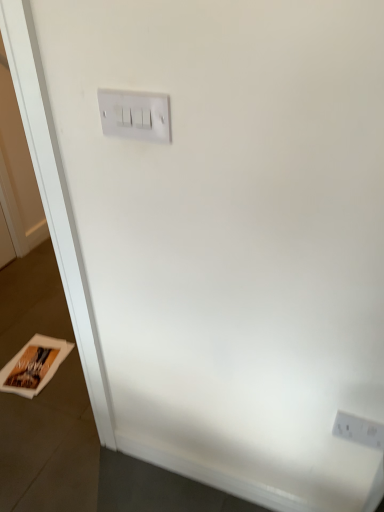
Describe the element at coordinates (359, 430) in the screenshot. Image resolution: width=384 pixels, height=512 pixels. I see `white plastic power plugs and sockets at lower right` at that location.

Identify the location of white plastic power plugs and sockets at lower right. This screenshot has width=384, height=512. (359, 430).

The image size is (384, 512). I want to click on white glossy magazine at lower left, so click(x=34, y=366).

What do you see at coordinates (34, 366) in the screenshot? This screenshot has height=512, width=384. I see `white glossy magazine at lower left` at bounding box center [34, 366].

Measure the distance between point [40,390] and camera.

The distance of point [40,390] from camera is 1.67 meters.

This screenshot has width=384, height=512. What are the coordinates of `white plastic power plugs and sockets at lower right` in the screenshot? It's located at (359, 430).

Which is more to the right, white plastic power plugs and sockets at lower right or white glossy magazine at lower left?

Positioned to the right is white plastic power plugs and sockets at lower right.

Is white plastic power plugs and sockets at lower right behind white glossy magazine at lower left?

No, it is not.

Considering the points (357, 426) and (6, 374), which point is in front, point (357, 426) or point (6, 374)?

The point (357, 426) is closer.

From the image's perspective, between white plastic power plugs and sockets at lower right and white glossy magazine at lower left, which one is located above?

From the image's view, white plastic power plugs and sockets at lower right is above.

From a real-world perspective, who is located higher, white plastic power plugs and sockets at lower right or white glossy magazine at lower left?

In real-world perspective, white plastic power plugs and sockets at lower right is above.

Can you confirm if white plastic power plugs and sockets at lower right is thinner than white glossy magazine at lower left?

Yes.

Considering the sizes of white plastic power plugs and sockets at lower right and white glossy magazine at lower left in the image, is white plastic power plugs and sockets at lower right taller or shorter than white glossy magazine at lower left?

Clearly, white plastic power plugs and sockets at lower right is taller compared to white glossy magazine at lower left.

Is white plastic power plugs and sockets at lower right bigger than white glossy magazine at lower left?

Actually, white plastic power plugs and sockets at lower right might be smaller than white glossy magazine at lower left.

Would you say white glossy magazine at lower left is part of white plastic power plugs and sockets at lower right's contents?

Actually, white glossy magazine at lower left is outside white plastic power plugs and sockets at lower right.

Is white plastic power plugs and sockets at lower right directly adjacent to white glossy magazine at lower left?

No, white plastic power plugs and sockets at lower right is not next to white glossy magazine at lower left.

Is white plastic power plugs and sockets at lower right positioned with its back to white glossy magazine at lower left?

white plastic power plugs and sockets at lower right is not turned away from white glossy magazine at lower left.

How distant is white plastic power plugs and sockets at lower right from white glossy magazine at lower left?

white plastic power plugs and sockets at lower right is 4.04 feet away from white glossy magazine at lower left.

What are the coordinates of `magazine that is below the white plastic power plugs and sockets at lower right (from the image's perspective)` in the screenshot? It's located at (34, 366).

Considering the relative positions of white glossy magazine at lower left and white plastic power plugs and sockets at lower right in the image provided, is white glossy magazine at lower left to the right of white plastic power plugs and sockets at lower right from the viewer's perspective?

No.

From the picture: Between white glossy magazine at lower left and white plastic power plugs and sockets at lower right, which one is positioned behind?

white glossy magazine at lower left is more distant.

Which is behind, point (52, 375) or point (337, 428)?

The point (52, 375) is farther from the camera.

From the image's perspective, between white glossy magazine at lower left and white plastic power plugs and sockets at lower right, which one is located above?

white plastic power plugs and sockets at lower right is shown above in the image.

From a real-world perspective, which object rests below the other?

white glossy magazine at lower left is physically lower.

Considering the relative sizes of white glossy magazine at lower left and white plastic power plugs and sockets at lower right in the image provided, is white glossy magazine at lower left thinner than white plastic power plugs and sockets at lower right?

No, white glossy magazine at lower left is not thinner than white plastic power plugs and sockets at lower right.

Considering the sizes of white glossy magazine at lower left and white plastic power plugs and sockets at lower right in the image, is white glossy magazine at lower left taller or shorter than white plastic power plugs and sockets at lower right?

Considering their sizes, white glossy magazine at lower left has less height than white plastic power plugs and sockets at lower right.

Considering the sizes of objects white glossy magazine at lower left and white plastic power plugs and sockets at lower right in the image provided, who is bigger, white glossy magazine at lower left or white plastic power plugs and sockets at lower right?

Bigger between the two is white glossy magazine at lower left.

Is white glossy magazine at lower left not inside white plastic power plugs and sockets at lower right?

Absolutely, white glossy magazine at lower left is external to white plastic power plugs and sockets at lower right.

Is there a large distance between white glossy magazine at lower left and white plastic power plugs and sockets at lower right?

Absolutely, white glossy magazine at lower left is distant from white plastic power plugs and sockets at lower right.

Could you tell me if white glossy magazine at lower left is turned towards white plastic power plugs and sockets at lower right?

No, white glossy magazine at lower left is not facing towards white plastic power plugs and sockets at lower right.

Can you tell me how much white glossy magazine at lower left and white plastic power plugs and sockets at lower right differ in facing direction?

There is a 5.18-degree angle between the facing directions of white glossy magazine at lower left and white plastic power plugs and sockets at lower right.

Find the location of a particular element. The image size is (384, 512). magazine below the white plastic power plugs and sockets at lower right (from the image's perspective) is located at coordinates [34, 366].

I want to click on power plugs and sockets that is above the white glossy magazine at lower left (from the image's perspective), so click(359, 430).

Locate an element on the screen. Image resolution: width=384 pixels, height=512 pixels. magazine below the white plastic power plugs and sockets at lower right (from a real-world perspective) is located at coordinates (34, 366).